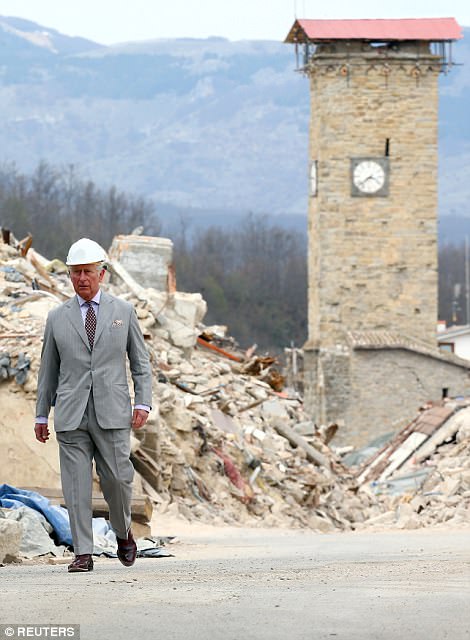
At what (x,y) coordinates should I click in order to perform the action: click on clock. Please return your answer as a coordinate pair (x, y). The width and height of the screenshot is (470, 640). Looking at the image, I should click on (360, 178).